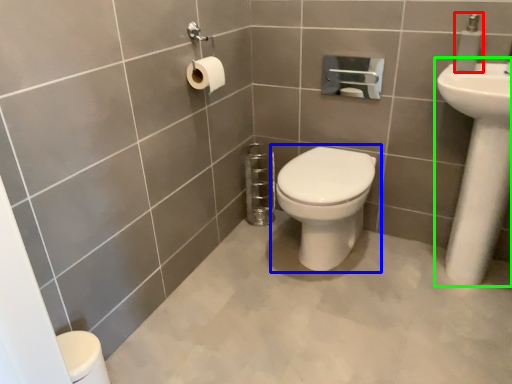
Question: Which is farther away from soap dispenser (highlighted by a red box)? toilet (highlighted by a blue box) or sink (highlighted by a green box)?

Choices:
 (A) toilet
 (B) sink

Answer: (A)